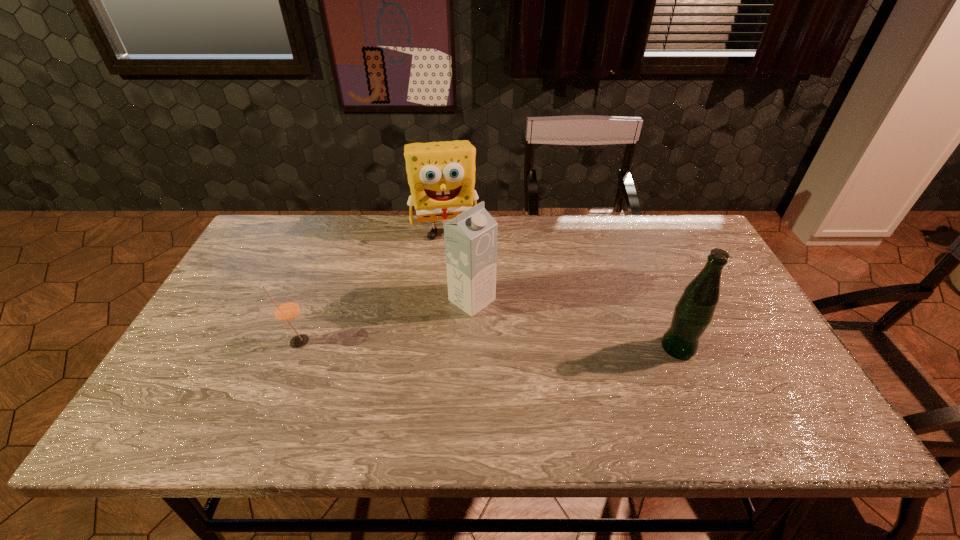
Identify the location of the shortest object. (286, 310).

The height and width of the screenshot is (540, 960). I want to click on the leftmost object, so click(x=286, y=310).

Where is `the rightmost object`? the rightmost object is located at coordinates (693, 313).

Locate an element on the screen. carton is located at coordinates (471, 237).

Where is `sponge`? sponge is located at coordinates (441, 175).

Locate an element on the screen. vacant region located on the back of the straw is located at coordinates (319, 287).

At what (x,y) coordinates should I click in order to perform the action: click on free space located 0.130m on the right of the rightmost object. Please return your answer as a coordinate pair (x, y). The height and width of the screenshot is (540, 960). Looking at the image, I should click on (747, 348).

The height and width of the screenshot is (540, 960). I want to click on vacant region located 0.140m on the front label of the carton, so click(x=529, y=340).

Identify the location of vacant space located 0.100m on the front label of the carton. [517, 332].

Find the location of a particular element. The height and width of the screenshot is (540, 960). vacant area located 0.340m on the front label of the carton is located at coordinates (597, 388).